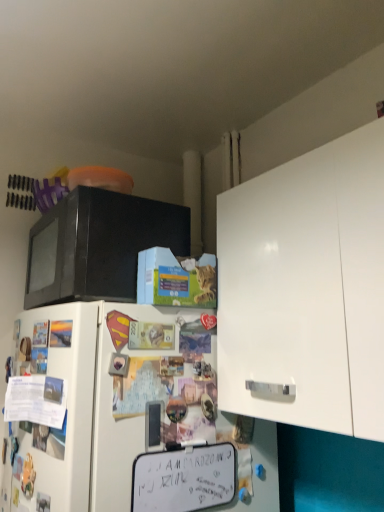
Question: Does black matte microwave at upper left have a smaller size compared to white matte refrigerator at lower left?

Choices:
 (A) no
 (B) yes

Answer: (B)

Question: Considering the relative positions of black matte microwave at upper left and white matte refrigerator at lower left in the image provided, is black matte microwave at upper left behind white matte refrigerator at lower left?

Choices:
 (A) yes
 (B) no

Answer: (A)

Question: Can you confirm if black matte microwave at upper left is wider than white matte refrigerator at lower left?

Choices:
 (A) yes
 (B) no

Answer: (B)

Question: Is black matte microwave at upper left outside of white matte refrigerator at lower left?

Choices:
 (A) yes
 (B) no

Answer: (A)

Question: From a real-world perspective, does black matte microwave at upper left stand above white matte refrigerator at lower left?

Choices:
 (A) yes
 (B) no

Answer: (A)

Question: Would you say white matte refrigerator at lower left is to the left or to the right of black matte microwave at upper left in the picture?

Choices:
 (A) right
 (B) left

Answer: (A)

Question: In the image, is white matte refrigerator at lower left positioned in front of or behind black matte microwave at upper left?

Choices:
 (A) front
 (B) behind

Answer: (A)

Question: In terms of size, does white matte refrigerator at lower left appear bigger or smaller than black matte microwave at upper left?

Choices:
 (A) big
 (B) small

Answer: (A)

Question: Is white matte refrigerator at lower left wider or thinner than black matte microwave at upper left?

Choices:
 (A) thin
 (B) wide

Answer: (B)

Question: Is black matte microwave at upper left bigger or smaller than white matte dry erase board at lower center?

Choices:
 (A) small
 (B) big

Answer: (B)

Question: In terms of width, does black matte microwave at upper left look wider or thinner when compared to white matte dry erase board at lower center?

Choices:
 (A) thin
 (B) wide

Answer: (B)

Question: Choose the correct answer: Is black matte microwave at upper left inside white matte dry erase board at lower center or outside it?

Choices:
 (A) inside
 (B) outside

Answer: (B)

Question: Does point (132, 224) appear closer or farther from the camera than point (145, 489)?

Choices:
 (A) farther
 (B) closer

Answer: (A)

Question: In the image, is white matte refrigerator at lower left on the left side or the right side of white matte cabinet at upper right?

Choices:
 (A) right
 (B) left

Answer: (B)

Question: Based on their sizes in the image, would you say white matte refrigerator at lower left is bigger or smaller than white matte cabinet at upper right?

Choices:
 (A) small
 (B) big

Answer: (B)